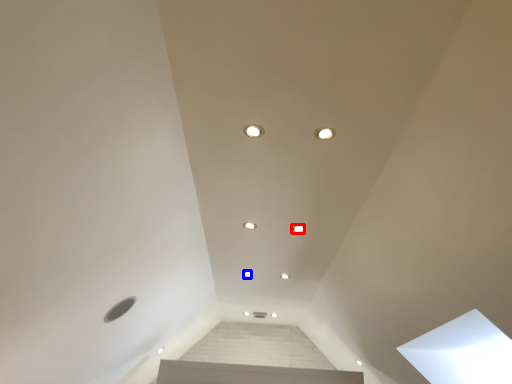
Question: Which point is closer to the camera, dot (highlighted by a red box) or dot (highlighted by a blue box)?

Choices:
 (A) dot
 (B) dot

Answer: (A)